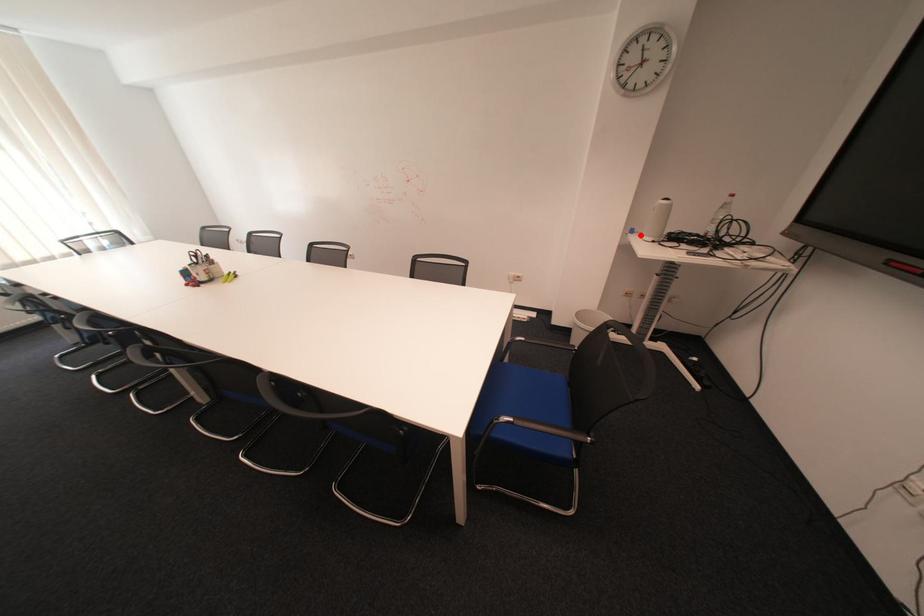
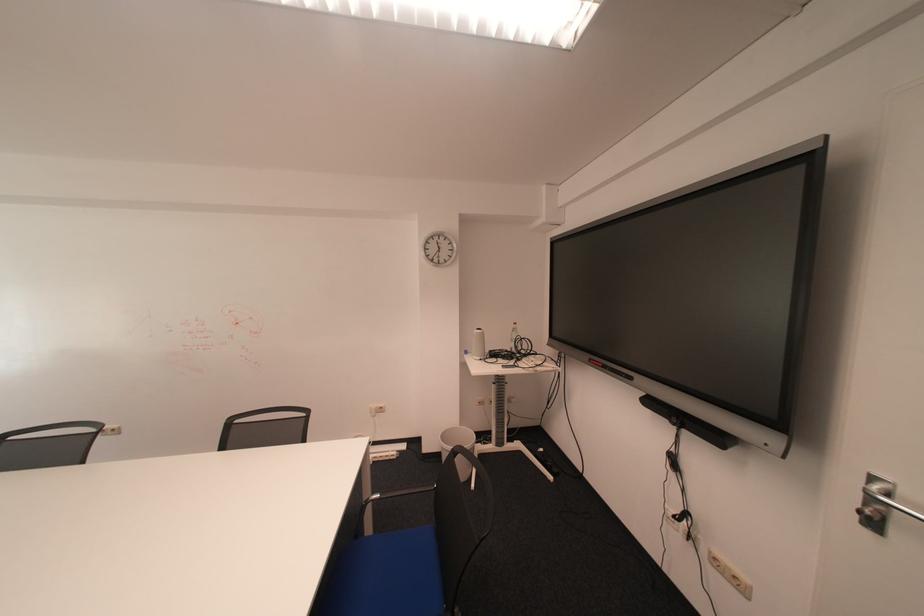
Question: I am providing you with two images of the same scene from different viewpoints. In image1, a red point is highlighted. Considering the same 3D point in image2, which of the following is correct?

Choices:
 (A) It is closer
 (B) It is farther

Answer: (B)